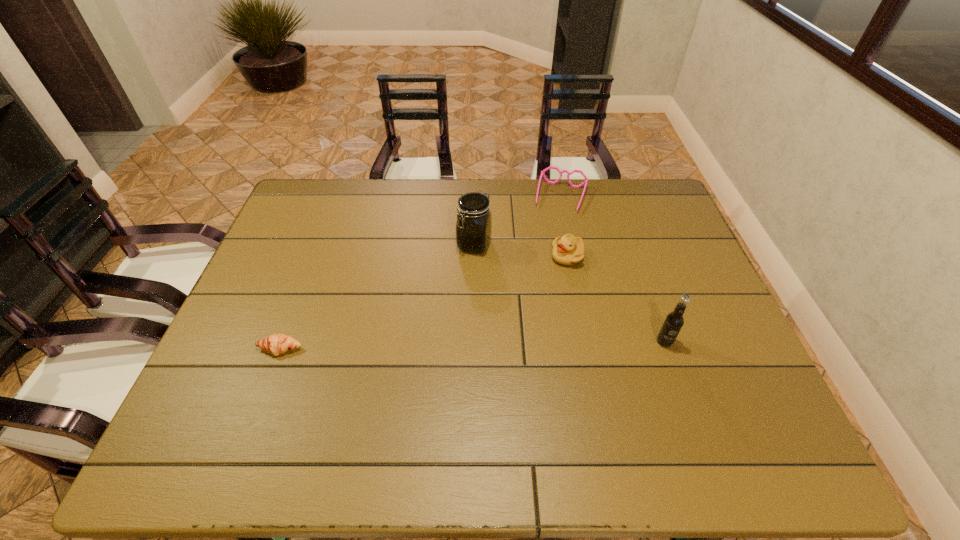
In the image, there is a desktop. Where is `vacant space at the far edge`? This screenshot has height=540, width=960. vacant space at the far edge is located at coordinates (456, 221).

This screenshot has width=960, height=540. In the image, there is a desktop. What are the coordinates of `vacant space at the near edge` in the screenshot? It's located at (510, 406).

Locate an element on the screen. vacant area at the left edge of the desktop is located at coordinates (271, 287).

Locate an element on the screen. vacant space at the right edge of the desktop is located at coordinates (650, 240).

In the image, there is a desktop. Identify the location of vacant area at the near left corner. This screenshot has height=540, width=960. (266, 401).

Where is `free spot between the jar and the spectacles`? free spot between the jar and the spectacles is located at coordinates (517, 221).

Where is `vacant space that is in between the pastry and the rightmost object`? The height and width of the screenshot is (540, 960). vacant space that is in between the pastry and the rightmost object is located at coordinates (472, 345).

I want to click on vacant area that lies between the root beer and the shortest object, so click(x=472, y=345).

Image resolution: width=960 pixels, height=540 pixels. Identify the location of free space between the leftmost object and the root beer. [472, 345].

This screenshot has height=540, width=960. In order to click on free space between the fourth object from right to left and the root beer in this screenshot , I will do `click(569, 293)`.